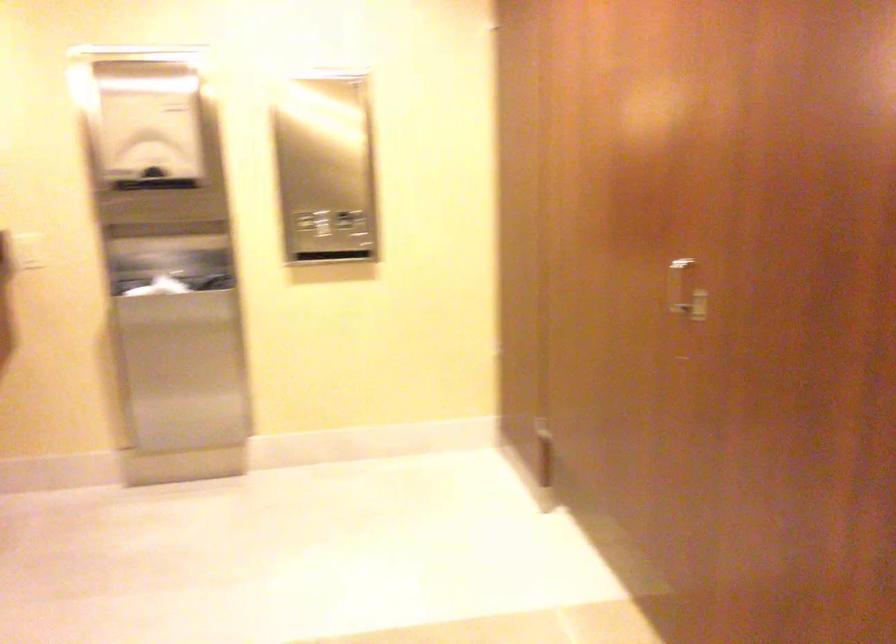
What are the coordinates of `metal door handle` in the screenshot? It's located at (685, 290).